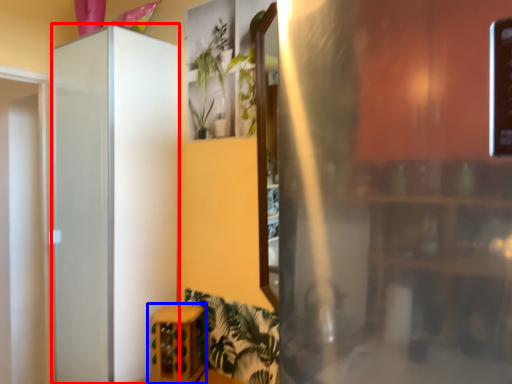
Question: Among these objects, which one is farthest to the camera, screen door (highlighted by a red box) or furniture (highlighted by a blue box)?

Choices:
 (A) screen door
 (B) furniture

Answer: (B)